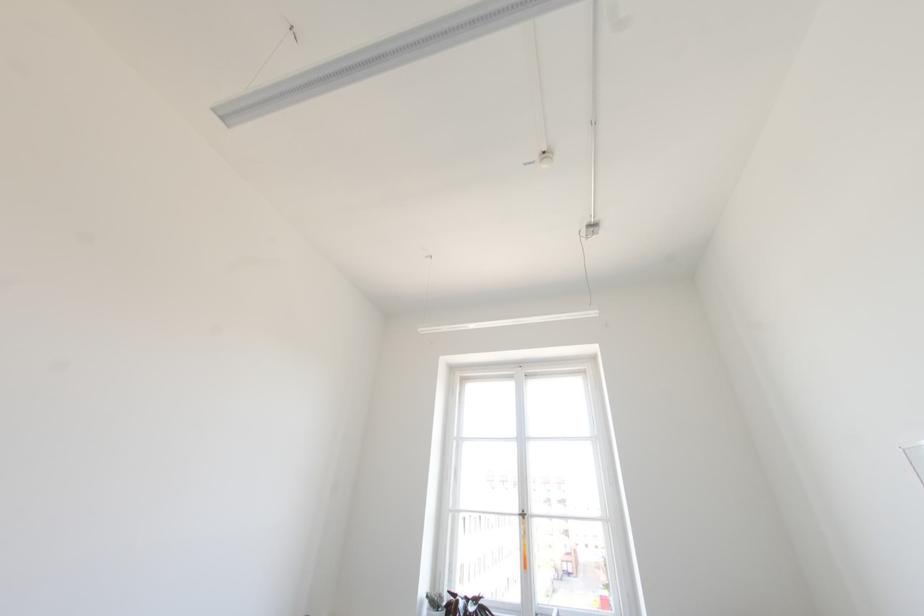
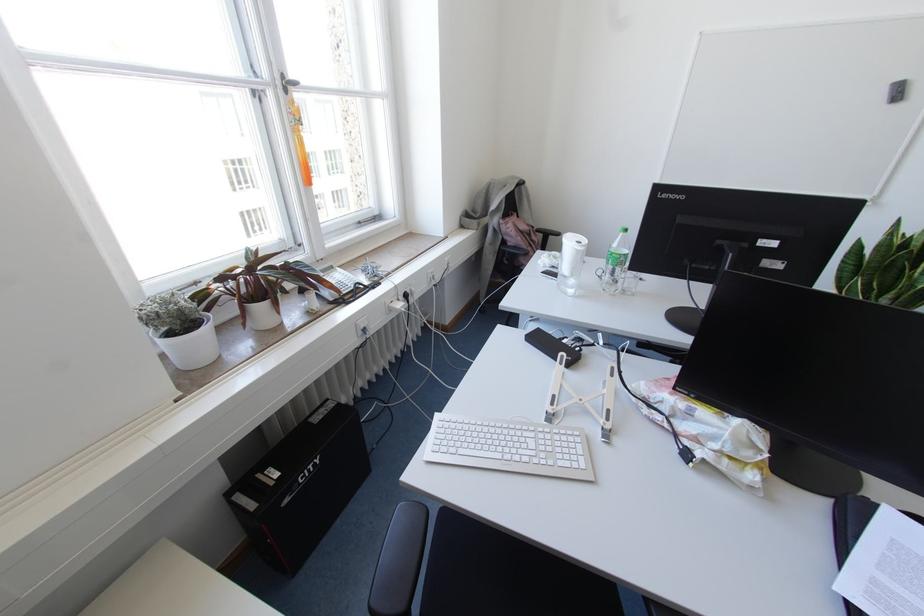
Locate, in the second image, the point that corresponds to (x=523, y=517) in the first image.

(285, 90)